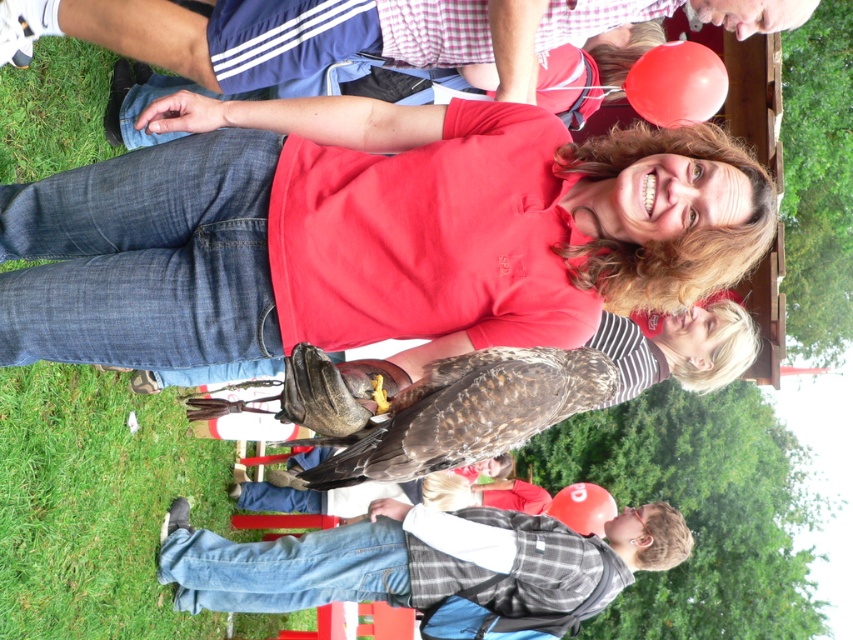
Is matte brown bird at center above brown feathered falcon at center?

Yes.

Does point (492, 220) lie in front of point (572, 397)?

No, (492, 220) is behind (572, 397).

Locate an element on the screen. matte brown bird at center is located at coordinates (368, 232).

Is denim jeans at lower left closer to camera compared to brown feathered falcon at center?

No, denim jeans at lower left is further to the viewer.

Which is in front, point (273, 602) or point (554, 404)?

Point (554, 404)

Where is `denim jeans at lower left`? denim jeans at lower left is located at coordinates (430, 564).

Can you confirm if matte brown bird at center is bigger than denim jeans at lower left?

Actually, matte brown bird at center might be smaller than denim jeans at lower left.

This screenshot has width=853, height=640. Identify the location of matte brown bird at center. (368, 232).

Identify the location of matte brown bird at center. The image size is (853, 640). point(368,232).